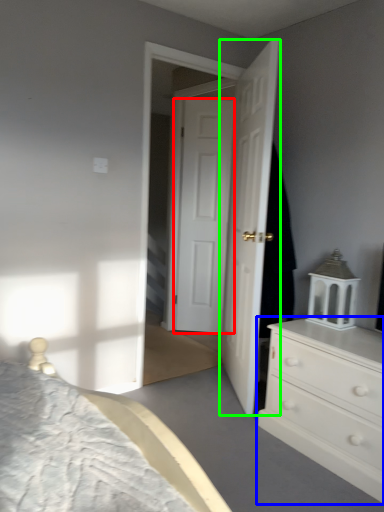
Question: Considering the real-world distances, which object is farthest from door (highlighted by a red box)? chest of drawers (highlighted by a blue box) or door (highlighted by a green box)?

Choices:
 (A) chest of drawers
 (B) door

Answer: (A)